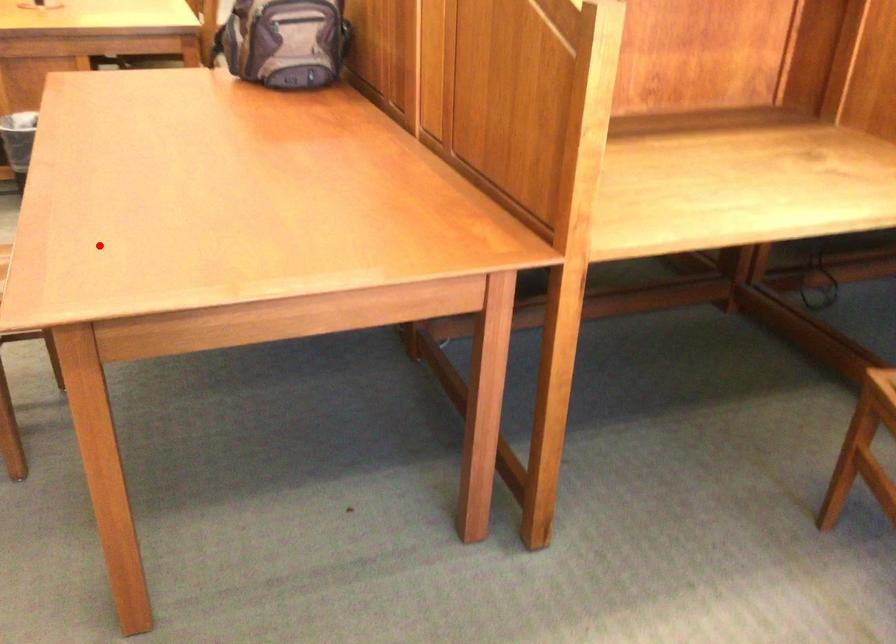
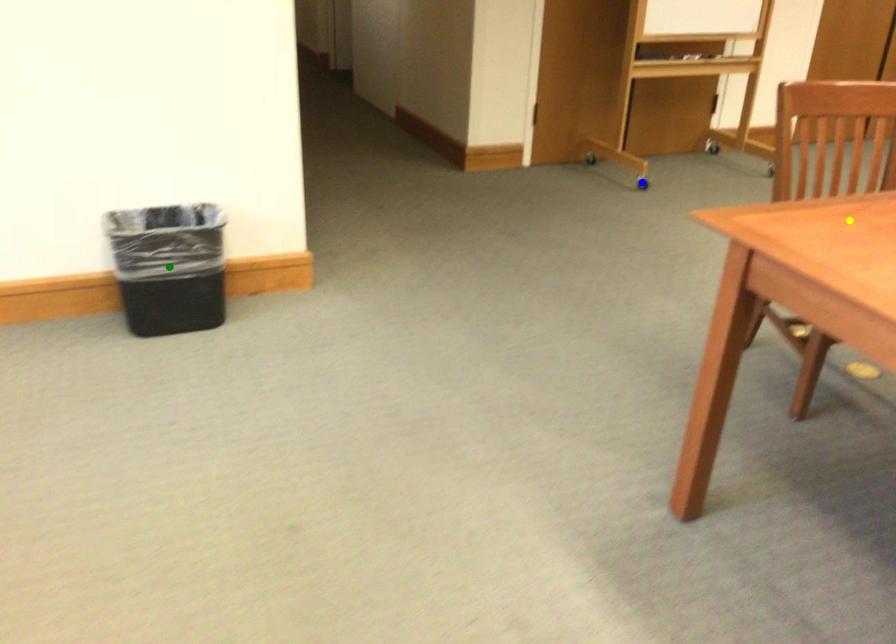
Question: I am providing you with two images of the same scene from different viewpoints. A red point is marked on the first image. You are given multiple points on the second image. Which spot in image 2 lines up with the point in image 1?

Choices:
 (A) green point
 (B) blue point
 (C) yellow point

Answer: (C)